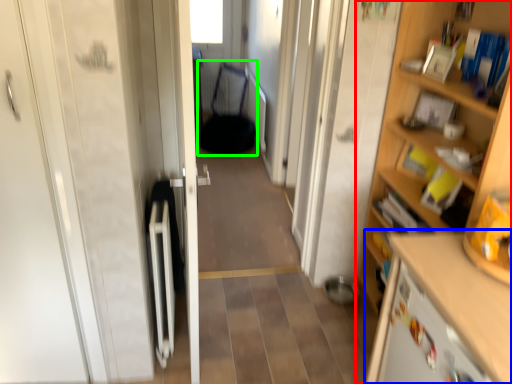
Question: Which is nearer to the cupboard (highlighted by a red box)? cabinetry (highlighted by a blue box) or armchair (highlighted by a green box).

Choices:
 (A) cabinetry
 (B) armchair

Answer: (A)